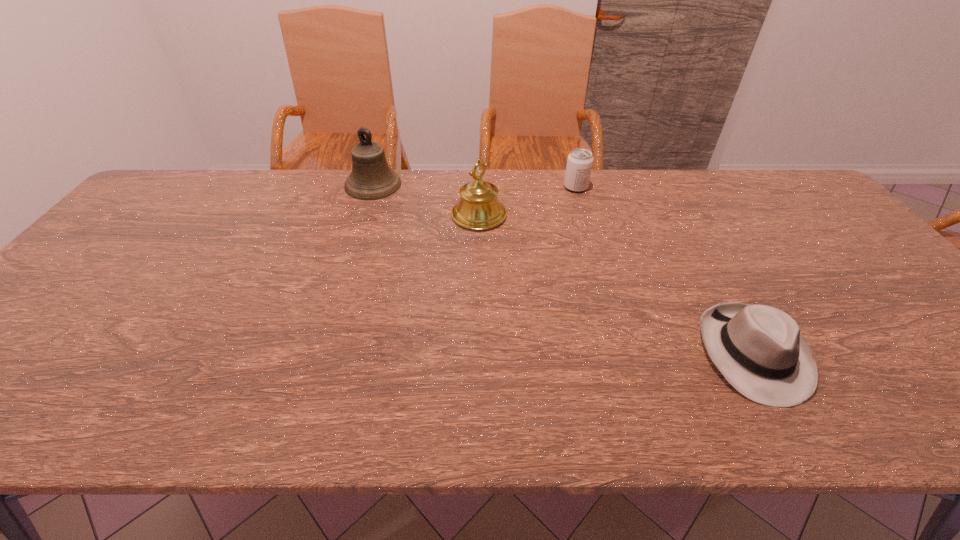
Where is `the left bell`? The width and height of the screenshot is (960, 540). the left bell is located at coordinates (371, 178).

Where is `the second object from left to right`? This screenshot has height=540, width=960. the second object from left to right is located at coordinates (478, 208).

Locate an element on the screen. This screenshot has width=960, height=540. the third tallest object is located at coordinates (579, 163).

Locate an element on the screen. soda can is located at coordinates (579, 163).

This screenshot has width=960, height=540. Find the location of `the nearest object`. the nearest object is located at coordinates (759, 349).

Identify the location of the rightmost object. Image resolution: width=960 pixels, height=540 pixels. (759, 349).

In order to click on vacant position located 0.270m on the left of the leftmost object in this screenshot , I will do `click(263, 185)`.

You are a GUI agent. You are given a task and a screenshot of the screen. Output one action in this format:
    pyautogui.click(x=<x>, y=<y>)
    Task: Click on the free space located 0.070m on the back of the second object from left to right
    
    Given the screenshot: What is the action you would take?
    pyautogui.click(x=479, y=187)

Where is `vacant region located 0.100m on the right of the soda can`? This screenshot has width=960, height=540. vacant region located 0.100m on the right of the soda can is located at coordinates pos(618,187).

Image resolution: width=960 pixels, height=540 pixels. Find the location of `soda can present at the far edge`. soda can present at the far edge is located at coordinates (579, 163).